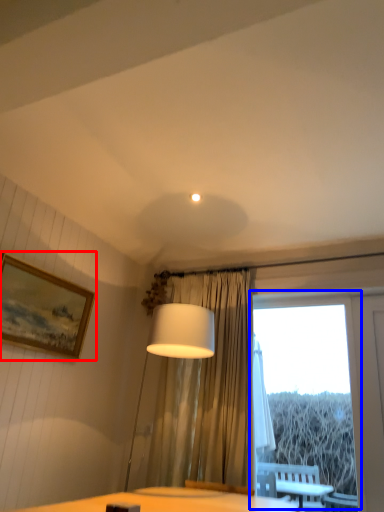
Question: Which object is further to the camera taking this photo, picture frame (highlighted by a red box) or window (highlighted by a blue box)?

Choices:
 (A) picture frame
 (B) window

Answer: (B)